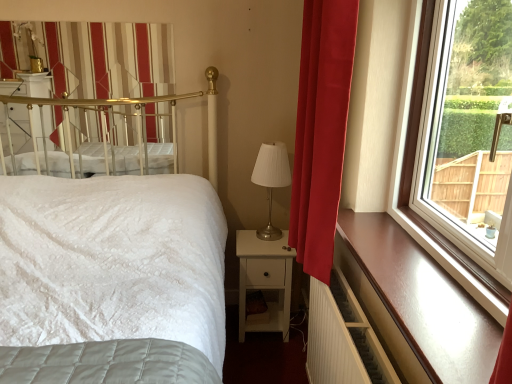
Question: Can you confirm if gold metallic canopy bed at upper left is thinner than red velvet curtain at right?

Choices:
 (A) yes
 (B) no

Answer: (A)

Question: Does gold metallic canopy bed at upper left lie behind red velvet curtain at right?

Choices:
 (A) no
 (B) yes

Answer: (B)

Question: From a real-world perspective, is gold metallic canopy bed at upper left under red velvet curtain at right?

Choices:
 (A) no
 (B) yes

Answer: (A)

Question: Can you confirm if gold metallic canopy bed at upper left is smaller than red velvet curtain at right?

Choices:
 (A) no
 (B) yes

Answer: (B)

Question: Can you confirm if gold metallic canopy bed at upper left is positioned to the right of red velvet curtain at right?

Choices:
 (A) yes
 (B) no

Answer: (B)

Question: From the image's perspective, does gold metallic canopy bed at upper left appear lower than red velvet curtain at right?

Choices:
 (A) yes
 (B) no

Answer: (B)

Question: Considering the relative positions of white glossy radiator at lower right and brown polished wood ledge at right in the image provided, is white glossy radiator at lower right to the right of brown polished wood ledge at right from the viewer's perspective?

Choices:
 (A) no
 (B) yes

Answer: (A)

Question: From a real-world perspective, is white glossy radiator at lower right on top of brown polished wood ledge at right?

Choices:
 (A) no
 (B) yes

Answer: (A)

Question: Is white glossy radiator at lower right facing towards brown polished wood ledge at right?

Choices:
 (A) no
 (B) yes

Answer: (A)

Question: Is white glossy radiator at lower right positioned behind brown polished wood ledge at right?

Choices:
 (A) no
 (B) yes

Answer: (B)

Question: Is white glossy radiator at lower right not close to brown polished wood ledge at right?

Choices:
 (A) no
 (B) yes

Answer: (A)

Question: Is white glossy radiator at lower right shorter than brown polished wood ledge at right?

Choices:
 (A) no
 (B) yes

Answer: (A)

Question: From the image's perspective, is metallic silver table lamp at center below white matte nightstand at center?

Choices:
 (A) no
 (B) yes

Answer: (A)